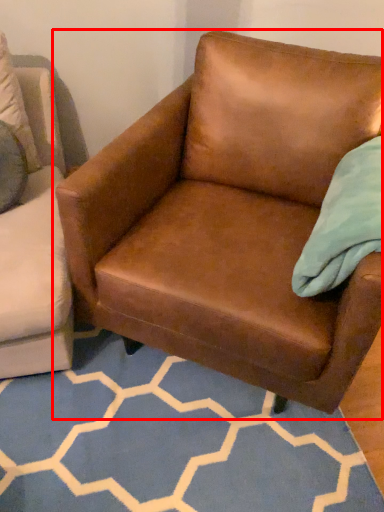
Question: Considering the relative positions of chair (annotated by the red box) and pattern in the image provided, where is chair (annotated by the red box) located with respect to the staircase?

Choices:
 (A) left
 (B) right

Answer: (B)